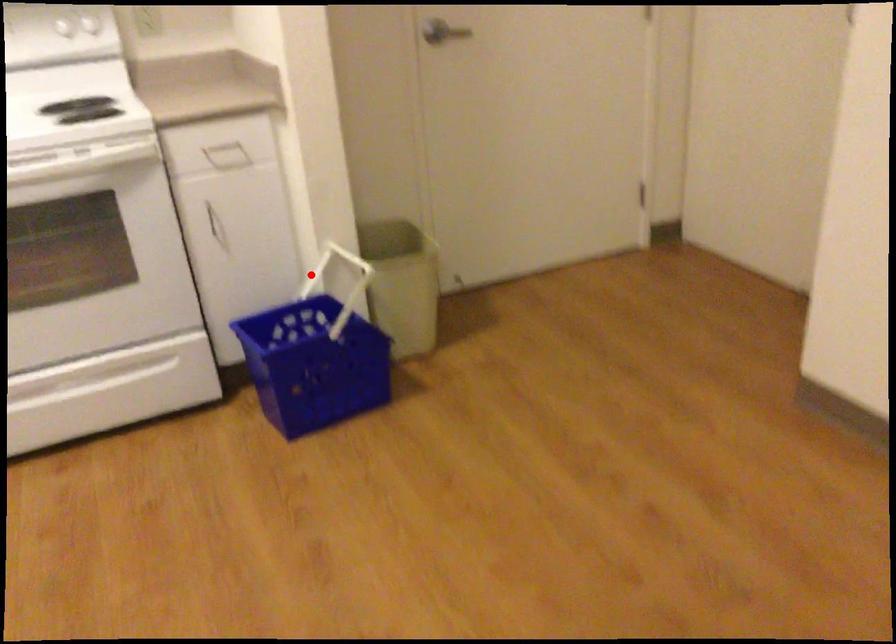
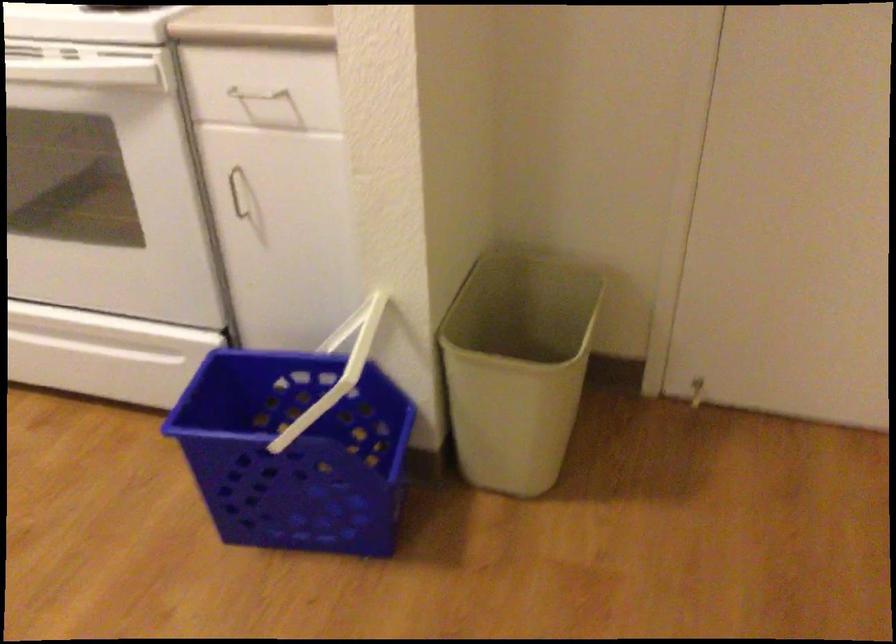
The point at the highlighted location is marked in the first image. Where is the corresponding point in the second image?

(346, 328)